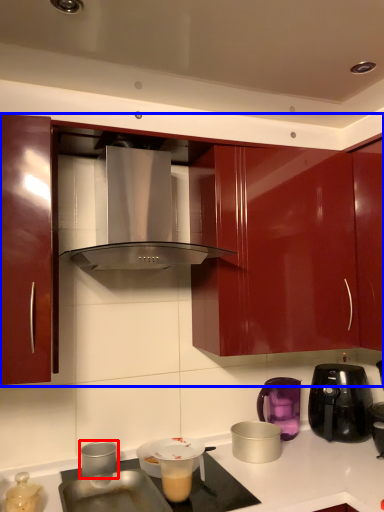
Question: Among these objects, which one is nearest to the camera, kitchen appliance (highlighted by a red box) or cabinetry (highlighted by a blue box)?

Choices:
 (A) kitchen appliance
 (B) cabinetry

Answer: (B)